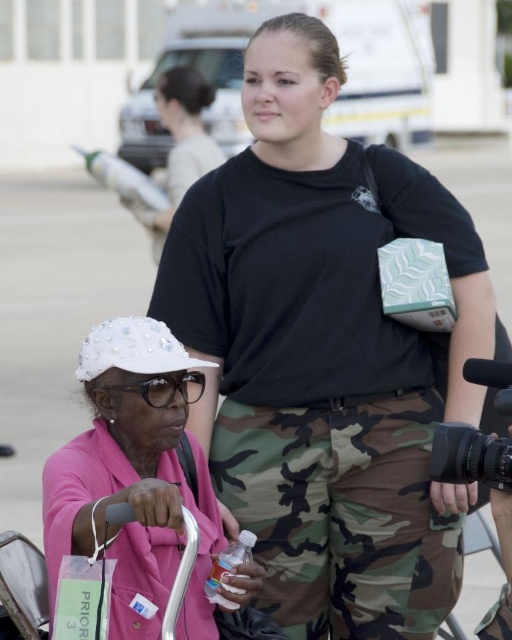
Who is positioned more to the right, camouflage pants at center or black plastic video camera at center right?

From the viewer's perspective, black plastic video camera at center right appears more on the right side.

Measure the distance between point (436, 419) and camera.

6.39 meters

Locate an element on the screen. The height and width of the screenshot is (640, 512). camouflage pants at center is located at coordinates (342, 513).

Where is `camouflage pants at center`? The image size is (512, 640). camouflage pants at center is located at coordinates (342, 513).

Does camo pants at center appear on the left side of matte black shirt at upper center?

Incorrect, camo pants at center is not on the left side of matte black shirt at upper center.

Is point (297, 172) less distant than point (173, 212)?

Yes, it is.

Locate an element on the screen. The width and height of the screenshot is (512, 640). camo pants at center is located at coordinates (324, 355).

You are a GUI agent. You are given a task and a screenshot of the screen. Output one action in this format:
    pyautogui.click(x=<x>, y=<y>)
    Task: Click on the camo pants at center
    The width and height of the screenshot is (512, 640).
    Given the screenshot: What is the action you would take?
    pyautogui.click(x=324, y=355)

Is camo pants at center to the left of white pearl hat at lower left from the viewer's perspective?

Incorrect, camo pants at center is not on the left side of white pearl hat at lower left.

The image size is (512, 640). What are the coordinates of `camo pants at center` in the screenshot? It's located at [324, 355].

Does point (385, 365) lie in front of point (153, 564)?

No, (385, 365) is behind (153, 564).

This screenshot has height=640, width=512. Find the location of `camo pants at center`. camo pants at center is located at coordinates (324, 355).